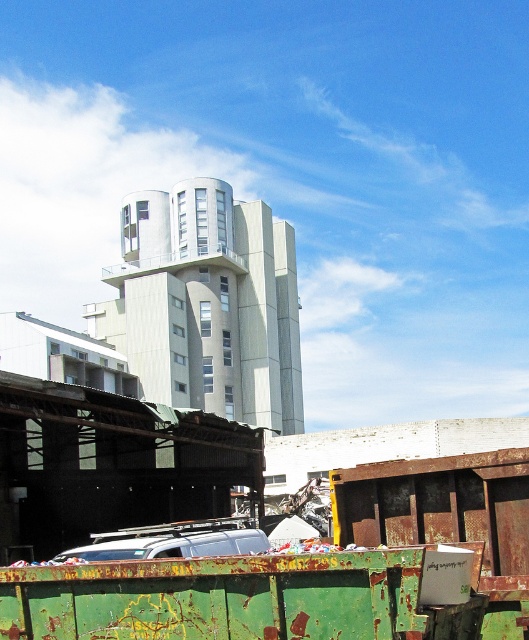
Question: Which point is farther to the camera?

Choices:
 (A) silver metallic van at lower center
 (B) rusty green dumpster at lower left

Answer: (A)

Question: In this image, where is rusty green dumpster at lower left located relative to silver metallic van at lower center?

Choices:
 (A) left
 (B) right

Answer: (B)

Question: Which point is farther to the camera?

Choices:
 (A) pyautogui.click(x=230, y=548)
 (B) pyautogui.click(x=139, y=596)

Answer: (A)

Question: Is rusty green dumpster at lower left below silver metallic van at lower center?

Choices:
 (A) yes
 (B) no

Answer: (B)

Question: From the image, what is the correct spatial relationship of rusty green dumpster at lower left in relation to silver metallic van at lower center?

Choices:
 (A) right
 (B) left

Answer: (A)

Question: Which object appears farthest from the camera in this image?

Choices:
 (A) rusty green dumpster at lower left
 (B) silver metallic van at lower center

Answer: (B)